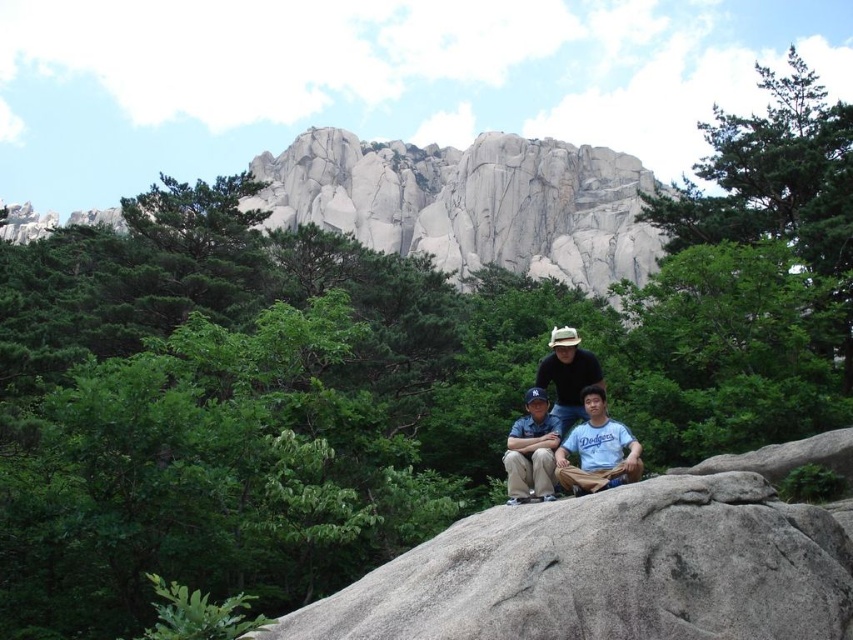
Looking at this image, can you confirm if granite rock formation at upper center is bigger than light blue t-shirt at center?

Indeed, granite rock formation at upper center has a larger size compared to light blue t-shirt at center.

Which of these two, granite rock formation at upper center or light blue t-shirt at center, stands taller?

With more height is granite rock formation at upper center.

At what (x,y) coordinates should I click in order to perform the action: click on granite rock formation at upper center. Please return your answer as a coordinate pair (x, y). The width and height of the screenshot is (853, 640). Looking at the image, I should click on (471, 204).

You are a GUI agent. You are given a task and a screenshot of the screen. Output one action in this format:
    pyautogui.click(x=<x>, y=<y>)
    Task: Click on the granite rock formation at upper center
    This screenshot has height=640, width=853.
    Given the screenshot: What is the action you would take?
    pyautogui.click(x=471, y=204)

Is granite rock formation at upper center smaller than denim shirt at center?

No, granite rock formation at upper center is not smaller than denim shirt at center.

Is point (573, 180) more distant than point (532, 493)?

Yes, point (573, 180) is behind point (532, 493).

Locate an element on the screen. The width and height of the screenshot is (853, 640). granite rock formation at upper center is located at coordinates (471, 204).

Is granite rock formation at upper center shorter than matte black shirt at center?

Incorrect, granite rock formation at upper center's height does not fall short of matte black shirt at center's.

The image size is (853, 640). Describe the element at coordinates (471, 204) in the screenshot. I see `granite rock formation at upper center` at that location.

This screenshot has height=640, width=853. Identify the location of granite rock formation at upper center. (471, 204).